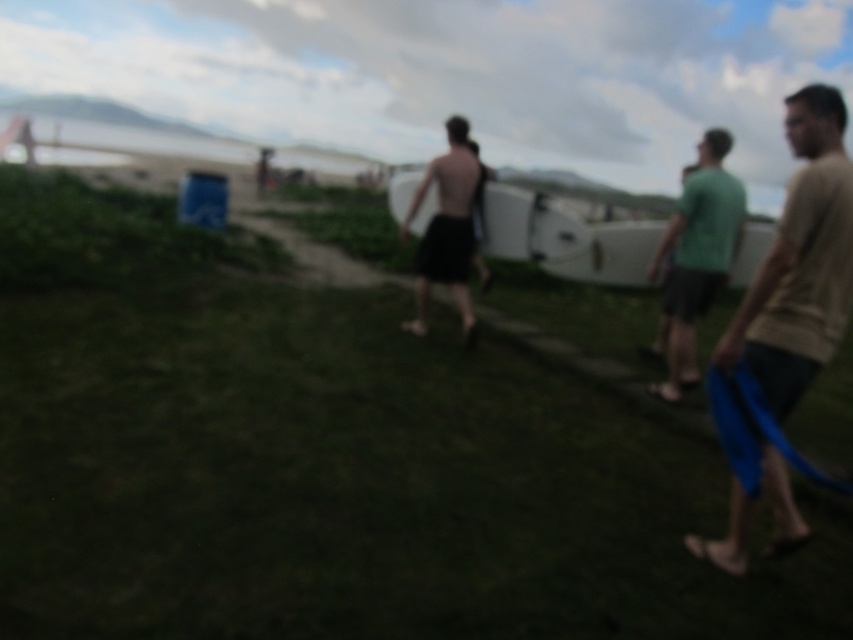
Question: Does tan fabric shorts at right appear over black matte surfboard at center?

Choices:
 (A) no
 (B) yes

Answer: (A)

Question: Which object is closer to the camera taking this photo?

Choices:
 (A) black matte surfboard at center
 (B) green matte shirt at right
 (C) tan fabric shorts at right
 (D) green grassy at center

Answer: (C)

Question: Does green grassy at center have a smaller size compared to green matte shirt at right?

Choices:
 (A) no
 (B) yes

Answer: (B)

Question: Estimate the real-world distances between objects in this image. Which object is closer to the green grassy at center?

Choices:
 (A) tan fabric shorts at right
 (B) black matte surfboard at center
 (C) green matte shirt at right

Answer: (A)

Question: Which object is farther from the camera taking this photo?

Choices:
 (A) black matte surfboard at center
 (B) green matte shirt at right

Answer: (A)

Question: Does green grassy at center appear on the right side of green matte shirt at right?

Choices:
 (A) no
 (B) yes

Answer: (A)